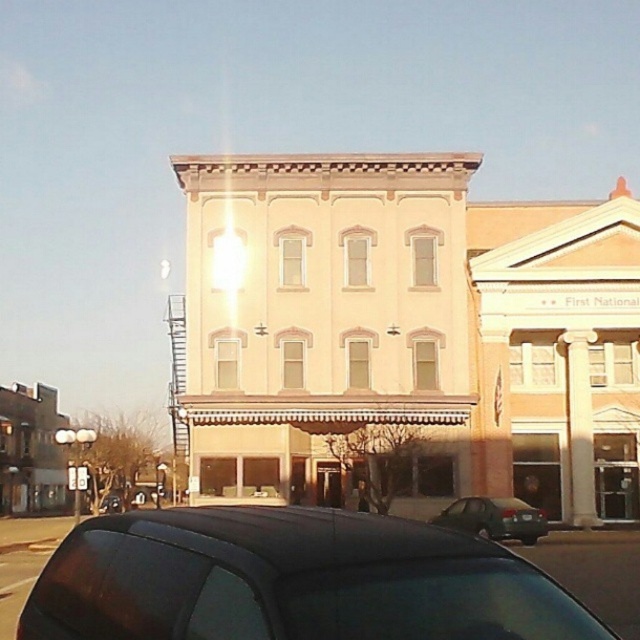
Is point (186, 195) positioned behind point (484, 513)?

That is True.

Is beige/smooth building at center wider than green matte sedan at lower center?

Yes.

Describe the element at coordinates (406, 336) in the screenshot. I see `beige/smooth building at center` at that location.

Image resolution: width=640 pixels, height=640 pixels. Find the location of `beige/smooth building at center`. beige/smooth building at center is located at coordinates (406, 336).

Image resolution: width=640 pixels, height=640 pixels. What do you see at coordinates (292, 580) in the screenshot?
I see `black matte car at lower center` at bounding box center [292, 580].

Can you confirm if black matte car at lower center is smaller than green matte sedan at lower center?

No, black matte car at lower center is not smaller than green matte sedan at lower center.

Does point (228, 582) lie behind point (476, 506)?

No, it is in front of (476, 506).

Where is `black matte car at lower center`? The image size is (640, 640). black matte car at lower center is located at coordinates (292, 580).

Does point (317, 419) come in front of point (125, 545)?

No, (317, 419) is behind (125, 545).

Does beige/smooth building at center appear over black matte car at lower center?

Correct, beige/smooth building at center is located above black matte car at lower center.

Describe the element at coordinates (406, 336) in the screenshot. I see `beige/smooth building at center` at that location.

In order to click on beige/smooth building at center in this screenshot , I will do `click(406, 336)`.